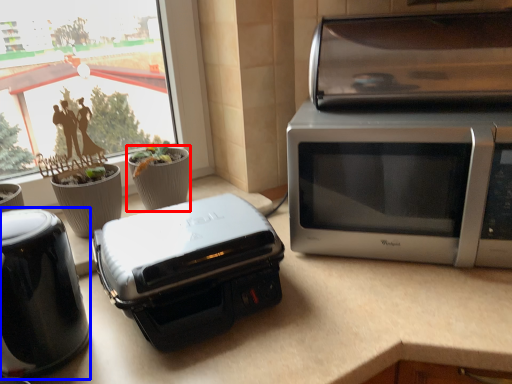
Question: Which of the following is the farthest to the observer, flowerpot (highlighted by a red box) or home appliance (highlighted by a blue box)?

Choices:
 (A) flowerpot
 (B) home appliance

Answer: (A)